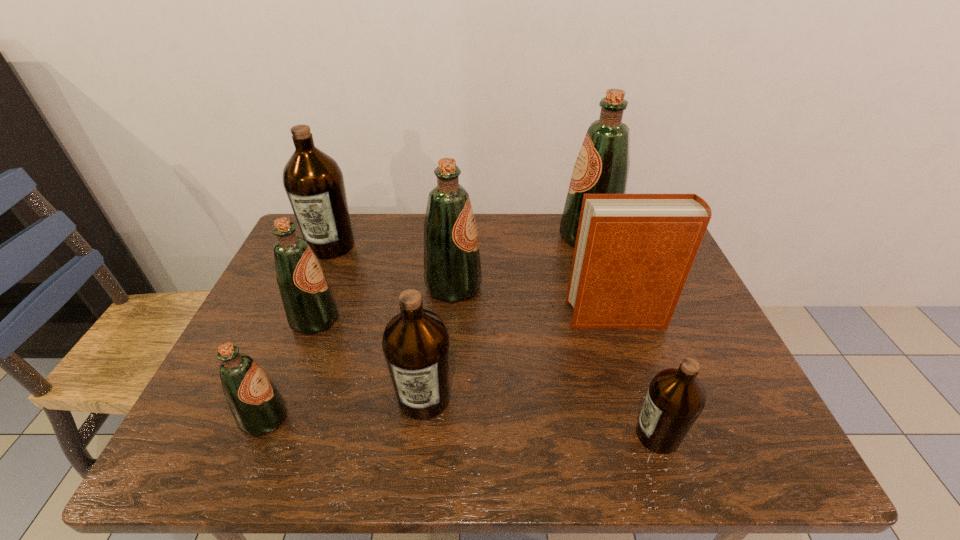
At what (x,y) coordinates should I click in order to perform the action: click on free location located 0.210m on the front-facing side of the rightmost green olive oil. Please return your answer as a coordinate pair (x, y). This screenshot has width=960, height=540. Looking at the image, I should click on (492, 237).

You are a GUI agent. You are given a task and a screenshot of the screen. Output one action in this format:
    pyautogui.click(x=<x>, y=<y>)
    Task: Click on the vacant space located 0.100m on the front-facing side of the rightmost green olive oil
    
    Given the screenshot: What is the action you would take?
    click(527, 237)

At what (x,y) coordinates should I click in order to perform the action: click on vacant space located 0.190m on the front-facing side of the rightmost green olive oil. Please return your answer as a coordinate pair (x, y). Looking at the image, I should click on (498, 237).

Where is `free space located on the label of the farthest brown olive oil`? The height and width of the screenshot is (540, 960). free space located on the label of the farthest brown olive oil is located at coordinates (288, 349).

Identify the location of free space located 0.200m on the front-facing side of the third green olive oil from left to right. This screenshot has height=540, width=960. (554, 287).

Locate an element on the screen. free space located on the open cover of the hardback book is located at coordinates (494, 316).

Locate an element on the screen. The width and height of the screenshot is (960, 540). vacant space situated 0.280m on the open cover of the hardback book is located at coordinates (459, 316).

This screenshot has width=960, height=540. Identify the location of vacant space located 0.350m on the open cover of the hardback book. (432, 316).

Where is `free space located on the front-facing side of the third biggest green olive oil`? This screenshot has width=960, height=540. free space located on the front-facing side of the third biggest green olive oil is located at coordinates (461, 320).

Locate an element on the screen. vacant space located 0.110m on the front-facing side of the smallest green olive oil is located at coordinates (341, 418).